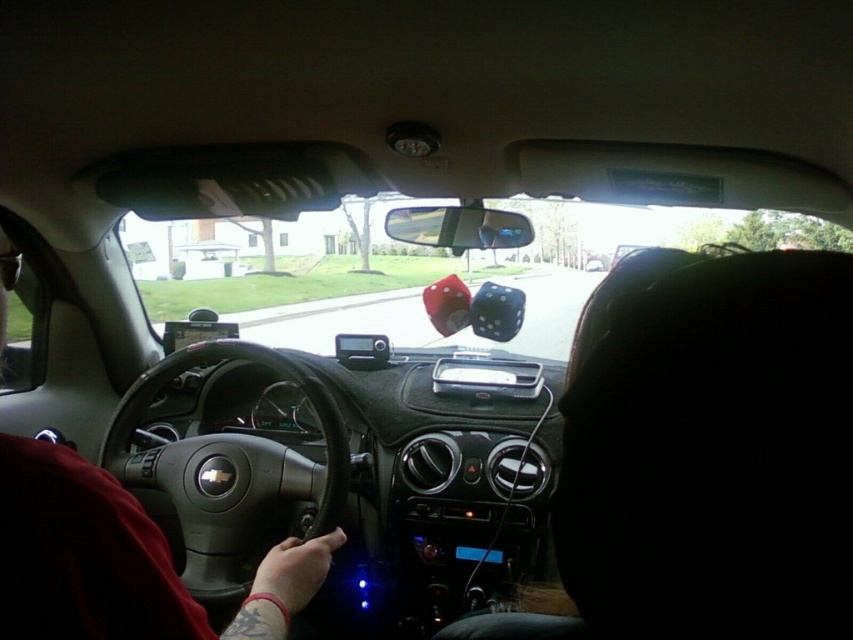
Question: Which object is the closest to the dark red leather jacket at lower left?

Choices:
 (A) matte black steering wheel at center
 (B) black fabric headrest at upper right

Answer: (B)

Question: Estimate the real-world distances between objects in this image. Which object is closer to the matte black steering wheel at center?

Choices:
 (A) dark red leather jacket at lower left
 (B) black fabric headrest at upper right

Answer: (B)

Question: Which point is farther to the camera?

Choices:
 (A) black fabric headrest at upper right
 (B) matte black steering wheel at center

Answer: (B)

Question: Does black fabric headrest at upper right come behind dark red leather jacket at lower left?

Choices:
 (A) no
 (B) yes

Answer: (A)

Question: Does black fabric headrest at upper right have a smaller size compared to matte black steering wheel at center?

Choices:
 (A) no
 (B) yes

Answer: (B)

Question: Can you confirm if black fabric headrest at upper right is thinner than dark red leather jacket at lower left?

Choices:
 (A) yes
 (B) no

Answer: (A)